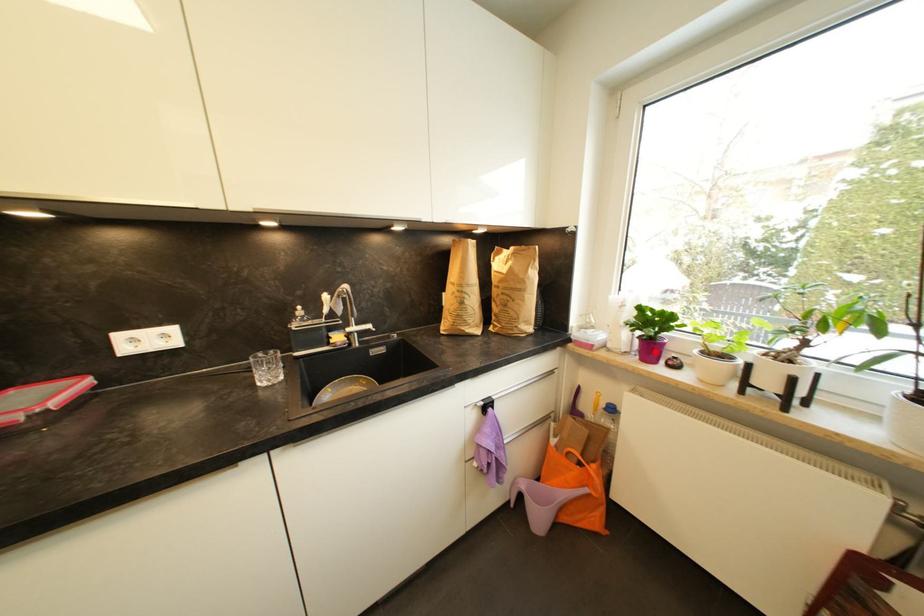
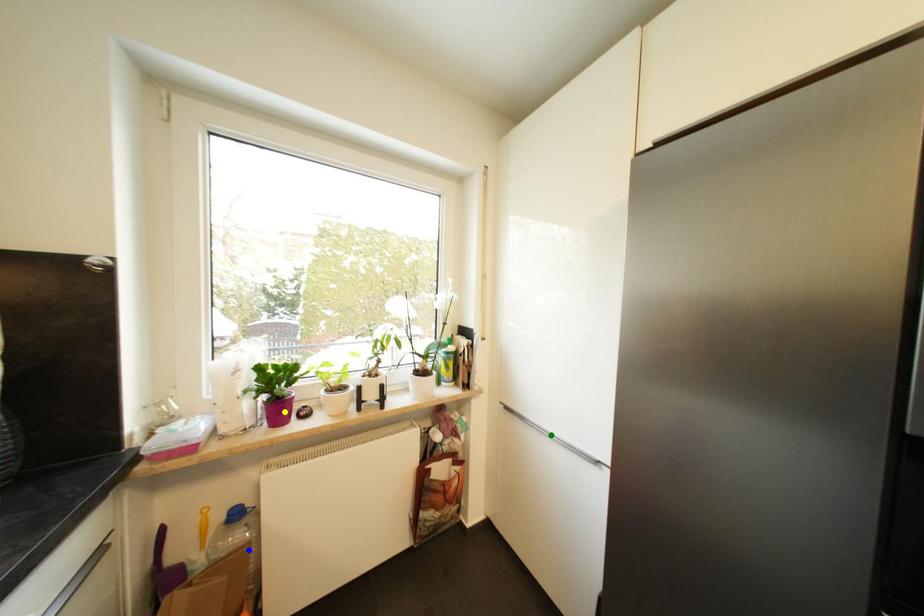
Question: I am providing you with two images of the same scene from different viewpoints. A red point is marked on the first image. You are given multiple points on the second image. Which point in image 2 represents the same 3d spot as the red point in image 1?

Choices:
 (A) blue point
 (B) green point
 (C) yellow point

Answer: (C)